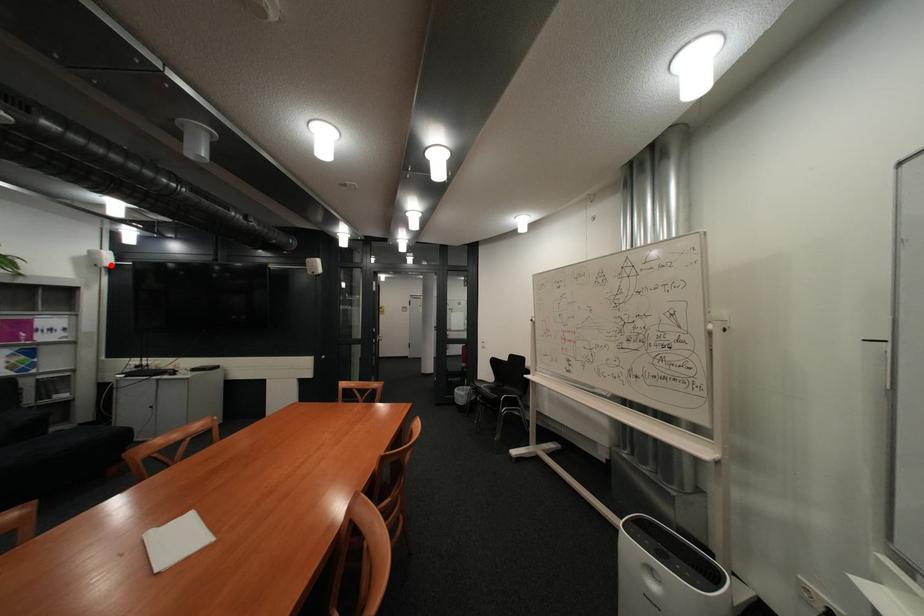
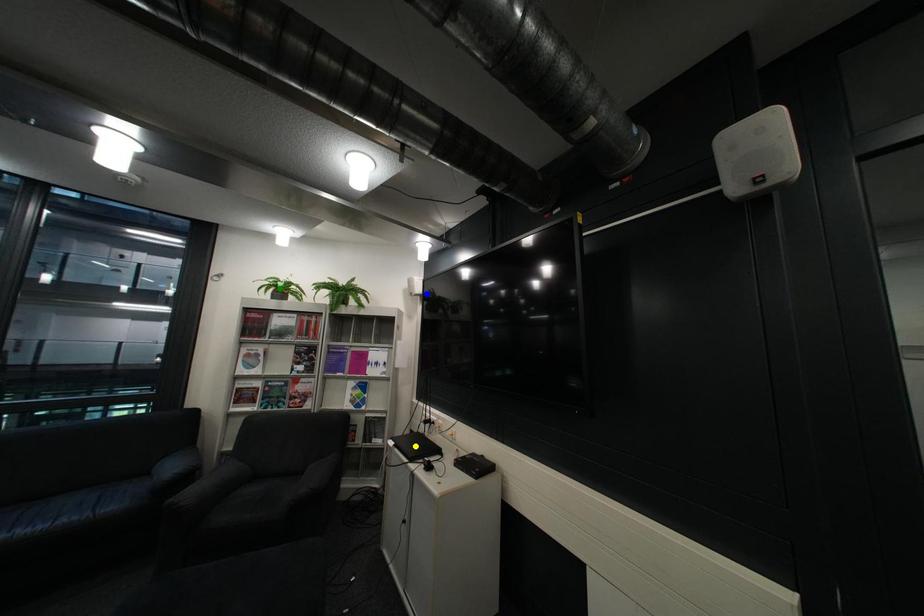
Question: I am providing you with two images of the same scene from different viewpoints. A red point is marked on the first image. You are given multiple points on the second image. Can you choose the point in image 2 that corresponds to the point in image 1?

Choices:
 (A) green point
 (B) blue point
 (C) yellow point

Answer: (B)